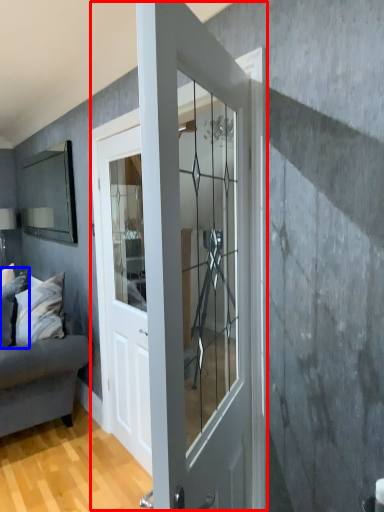
Question: Among these objects, which one is nearest to the camera, door (highlighted by a red box) or pillow (highlighted by a blue box)?

Choices:
 (A) door
 (B) pillow

Answer: (A)